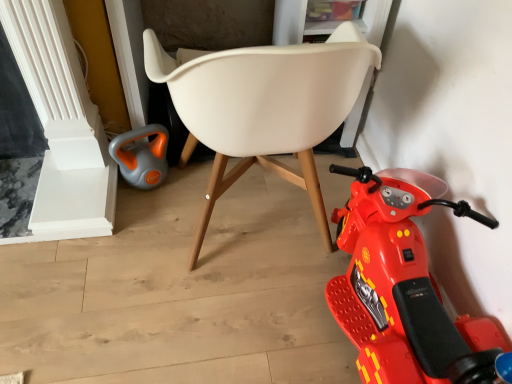
Find the location of `vacant space to the right of gray-orange plastic kettle at lower left`. vacant space to the right of gray-orange plastic kettle at lower left is located at coordinates (190, 185).